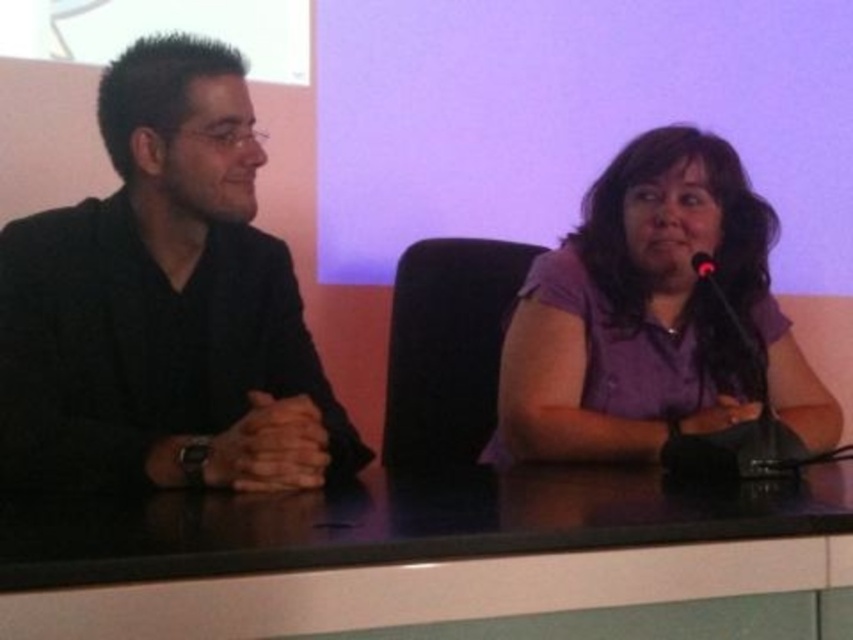
Question: Which object is positioned closest to the purple fabric shirt at right?

Choices:
 (A) black glossy table at center
 (B) black matte microphone at right

Answer: (B)

Question: Which point is farther to the camera?

Choices:
 (A) black matte microphone at right
 (B) black matte shirt at left
 (C) purple fabric shirt at right
 (D) black glossy table at center

Answer: (A)

Question: Which point is farther to the camera?

Choices:
 (A) (245, 608)
 (B) (671, 442)

Answer: (B)

Question: Is the position of black matte shirt at left more distant than that of black matte microphone at right?

Choices:
 (A) no
 (B) yes

Answer: (A)

Question: Can you confirm if black glossy table at center is positioned to the left of black matte microphone at right?

Choices:
 (A) yes
 (B) no

Answer: (A)

Question: Is black matte shirt at left bigger than black matte microphone at right?

Choices:
 (A) no
 (B) yes

Answer: (B)